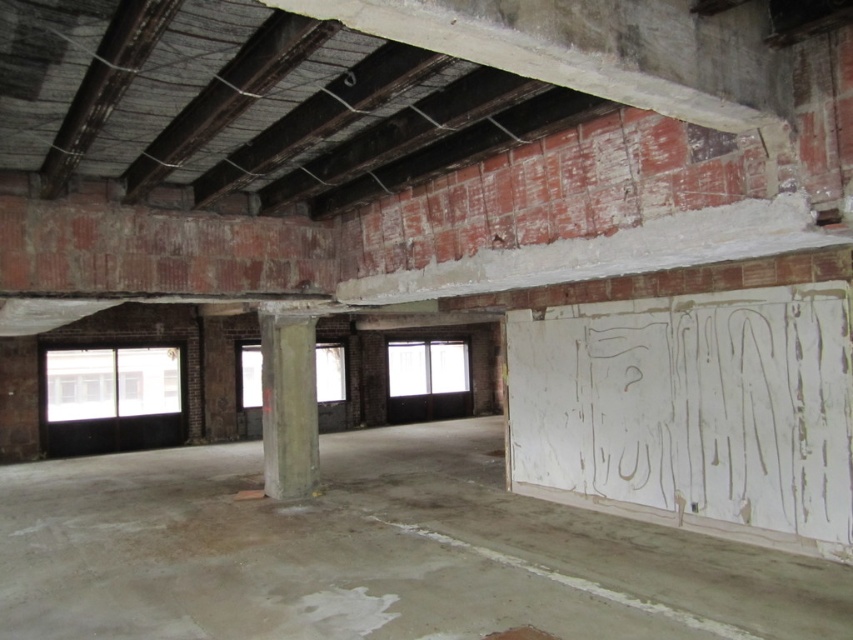
Which is behind, point (337, 467) or point (315, 394)?

The point (337, 467) is more distant.

Is concrete floor at center below concrete pillar at center?

Correct, concrete floor at center is located below concrete pillar at center.

Between point (316, 506) and point (289, 440), which one is positioned behind?

The point (289, 440) is more distant.

Image resolution: width=853 pixels, height=640 pixels. Find the location of `concrete floor at center`. concrete floor at center is located at coordinates (372, 554).